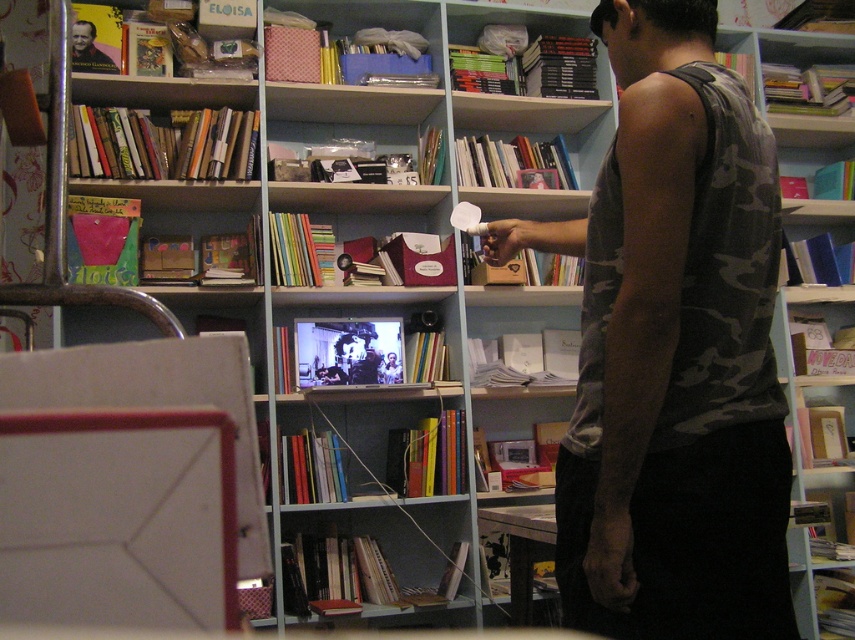
Who is positioned more to the left, camouflage tank top at center or smooth brown book at upper left?

smooth brown book at upper left

Is camouflage tank top at center taller than smooth brown book at upper left?

Indeed, camouflage tank top at center has a greater height compared to smooth brown book at upper left.

Between point (730, 280) and point (86, 33), which one is positioned in front?

Point (730, 280)

You are a GUI agent. You are given a task and a screenshot of the screen. Output one action in this format:
    pyautogui.click(x=<x>, y=<y>)
    Task: Click on the camouflage tank top at center
    This screenshot has height=640, width=855.
    Given the screenshot: What is the action you would take?
    pyautogui.click(x=673, y=349)